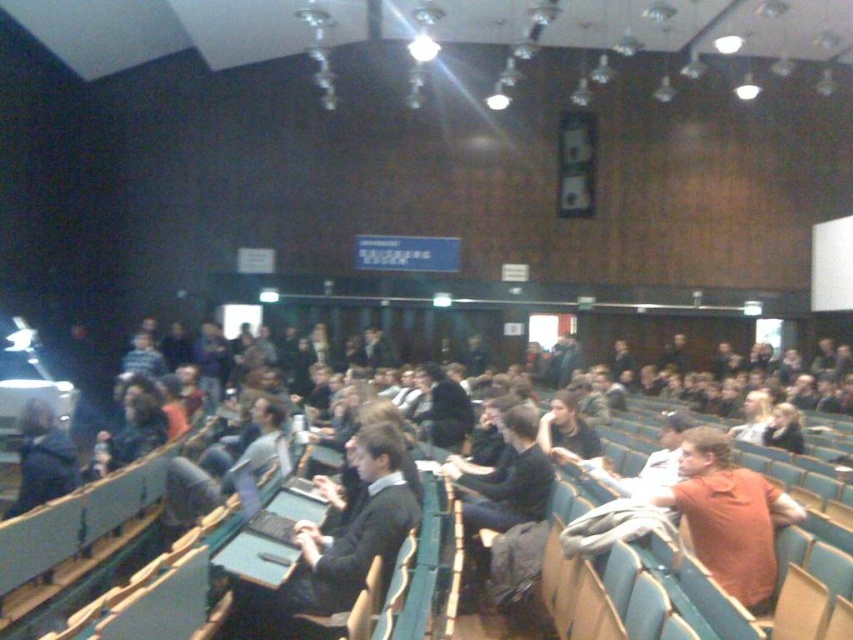
Question: Does dark gray sweater at center have a larger size compared to orange matte shirt at center?

Choices:
 (A) no
 (B) yes

Answer: (B)

Question: Does dark gray sweater at center appear under orange matte shirt at center?

Choices:
 (A) yes
 (B) no

Answer: (B)

Question: Which point appears closest to the camera in this image?

Choices:
 (A) (376, 486)
 (B) (759, 573)

Answer: (B)

Question: Among these points, which one is nearest to the camera?

Choices:
 (A) (57, 436)
 (B) (737, 588)
 (C) (358, 436)

Answer: (B)

Question: Is orange matte shirt at center below dark blue jacket at center?

Choices:
 (A) yes
 (B) no

Answer: (A)

Question: Which object appears closest to the camera in this image?

Choices:
 (A) dark gray sweater at center
 (B) orange matte shirt at center
 (C) dark blue jacket at center

Answer: (A)